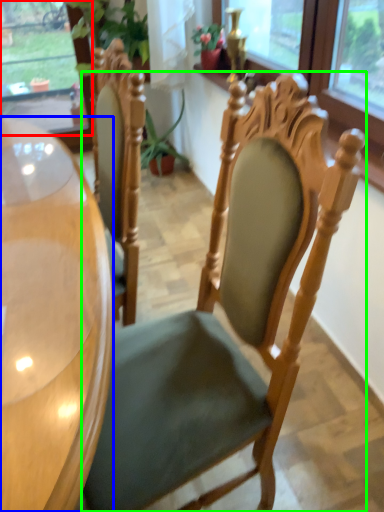
Question: Considering the real-world distances, which object is farthest from window (highlighted by a red box)? desk (highlighted by a blue box) or chair (highlighted by a green box)?

Choices:
 (A) desk
 (B) chair

Answer: (B)